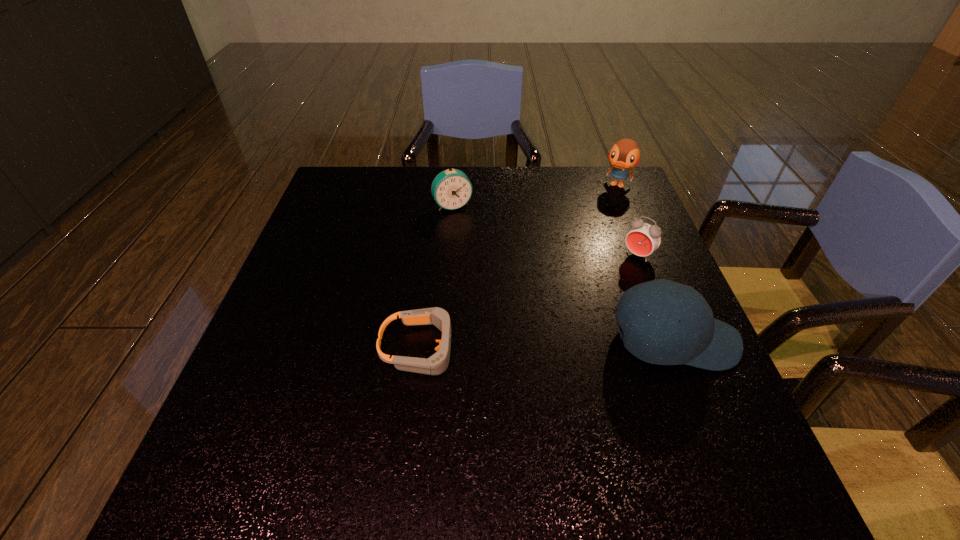
Locate an element on the screen. vacant space on the desktop that is between the shortest object and the baseball cap and is positioned on the face of the third farthest object is located at coordinates (552, 345).

The height and width of the screenshot is (540, 960). In order to click on vacant space on the desktop that is between the goggles and the baseball cap and is positioned on the front-facing side of the left alarm clock in this screenshot , I will do `click(523, 346)`.

This screenshot has width=960, height=540. I want to click on free space on the desktop that is between the shortest object and the baseball cap and is positioned on the front-facing side of the farthest object, so click(x=540, y=345).